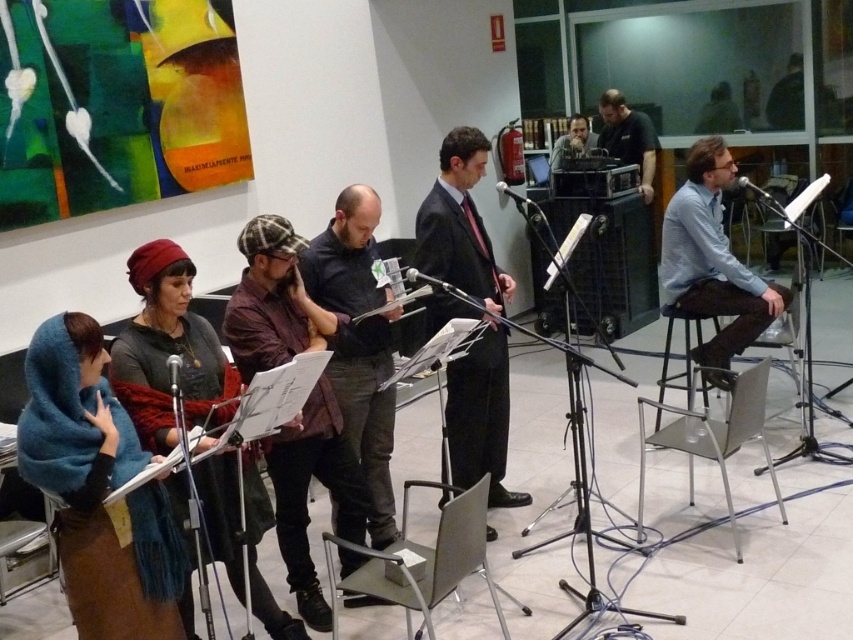
Question: Does dark suit at center appear on the right side of blue shirt at center?

Choices:
 (A) no
 (B) yes

Answer: (A)

Question: Based on their relative distances, which object is farther from the dark green shirt at upper right?

Choices:
 (A) dark brown leather jacket at center
 (B) blue shirt at center

Answer: (A)

Question: Does dark brown leather jacket at center have a greater width compared to blue shirt at center?

Choices:
 (A) no
 (B) yes

Answer: (A)

Question: Which object is closer to the camera taking this photo?

Choices:
 (A) blue shirt at center
 (B) dark suit at center

Answer: (B)

Question: Which point is farther from the camera taking this photo?

Choices:
 (A) (383, 422)
 (B) (747, 346)
 (C) (619, 156)

Answer: (C)

Question: Can you confirm if blue shirt at center is positioned to the left of dark green shirt at upper right?

Choices:
 (A) no
 (B) yes

Answer: (B)